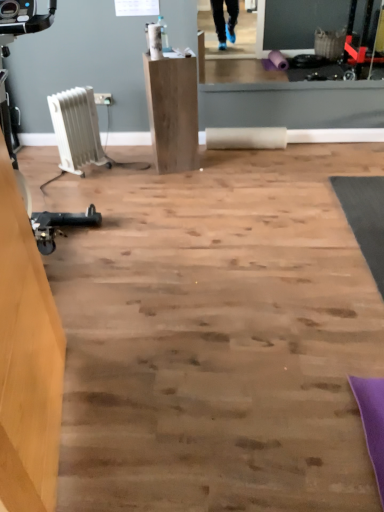
Question: Considering the relative sizes of white plastic heater at left and natural wood pedestal at center, the 1th furniture viewed from the back, in the image provided, is white plastic heater at left wider than natural wood pedestal at center, the 1th furniture viewed from the back,?

Choices:
 (A) no
 (B) yes

Answer: (B)

Question: Is white plastic heater at left oriented towards natural wood pedestal at center, arranged as the second furniture when viewed from the left?

Choices:
 (A) no
 (B) yes

Answer: (B)

Question: Considering the relative sizes of white plastic heater at left and natural wood pedestal at center, arranged as the second furniture when viewed from the left, in the image provided, is white plastic heater at left thinner than natural wood pedestal at center, arranged as the second furniture when viewed from the left,?

Choices:
 (A) no
 (B) yes

Answer: (A)

Question: Is white plastic heater at left positioned far away from natural wood pedestal at center, arranged as the second furniture when ordered from the bottom?

Choices:
 (A) no
 (B) yes

Answer: (A)

Question: Would you say white plastic heater at left contains natural wood pedestal at center, the 1th furniture viewed from the back?

Choices:
 (A) yes
 (B) no

Answer: (B)

Question: Is white plastic heater at left located outside natural wood pedestal at center, the 1th furniture viewed from the top?

Choices:
 (A) no
 (B) yes

Answer: (B)

Question: Could wooden desk at left, arranged as the 1th furniture when viewed from the front, be considered to be inside natural wood pedestal at center, the 1th furniture viewed from the top?

Choices:
 (A) no
 (B) yes

Answer: (A)

Question: Is natural wood pedestal at center, arranged as the second furniture when viewed from the left, wider than wooden desk at left, acting as the 1th furniture starting from the left?

Choices:
 (A) no
 (B) yes

Answer: (B)

Question: Is natural wood pedestal at center, acting as the 2th furniture starting from the front, not near wooden desk at left, placed as the second furniture when sorted from back to front?

Choices:
 (A) yes
 (B) no

Answer: (A)

Question: Considering the relative positions of natural wood pedestal at center, arranged as the second furniture when ordered from the bottom, and wooden desk at left, the 1th furniture positioned from the bottom, in the image provided, is natural wood pedestal at center, arranged as the second furniture when ordered from the bottom, behind wooden desk at left, the 1th furniture positioned from the bottom,?

Choices:
 (A) no
 (B) yes

Answer: (B)

Question: From the image's perspective, would you say natural wood pedestal at center, acting as the 2th furniture starting from the front, is positioned over wooden desk at left, arranged as the 1th furniture when viewed from the front?

Choices:
 (A) yes
 (B) no

Answer: (A)

Question: Does natural wood pedestal at center, arranged as the second furniture when ordered from the bottom, have a lesser width compared to wooden desk at left, the second furniture positioned from the top?

Choices:
 (A) no
 (B) yes

Answer: (A)

Question: Can you confirm if white plastic heater at left is shorter than white plastic radiator at left?

Choices:
 (A) yes
 (B) no

Answer: (B)